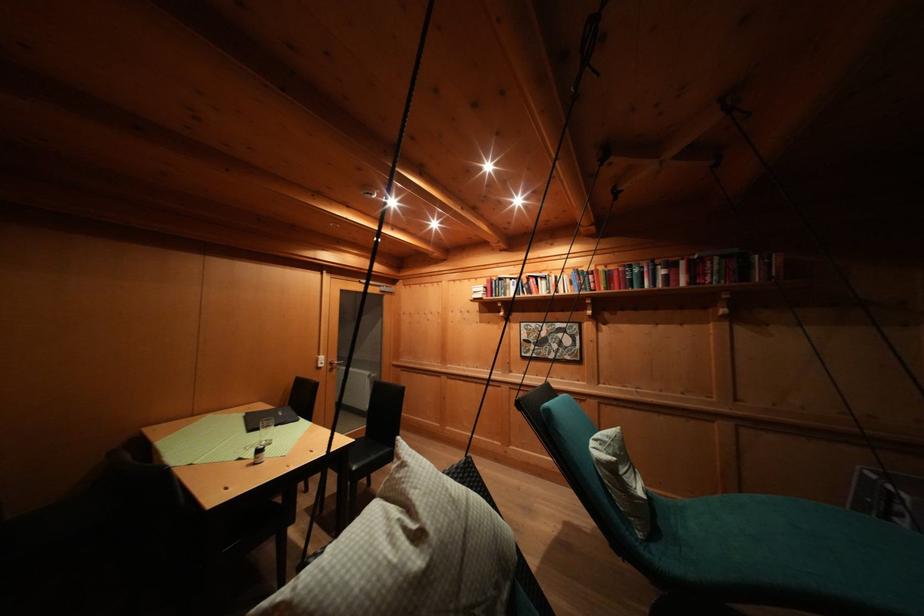
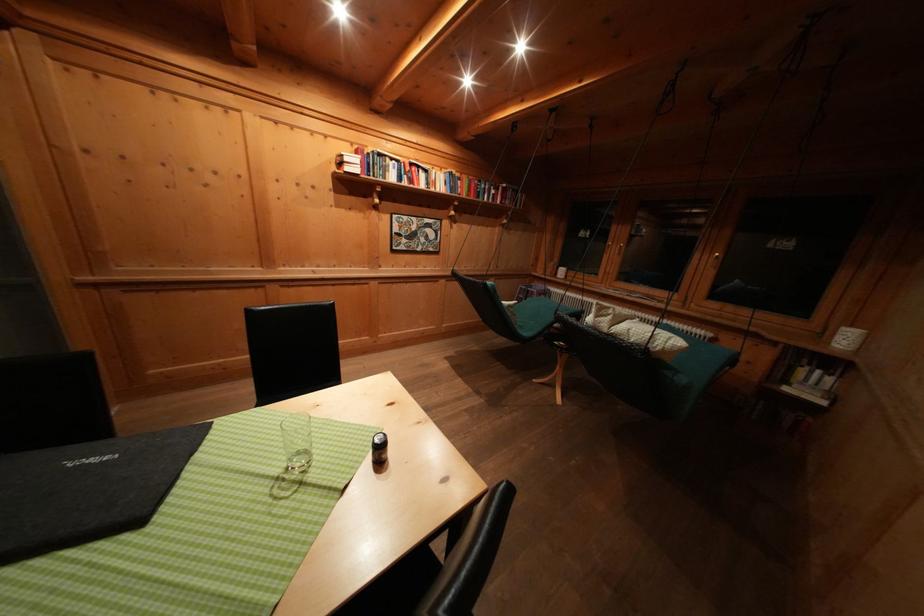
Where in the second image is the point corresponding to pixel 535 282 from the first image?

(418, 169)